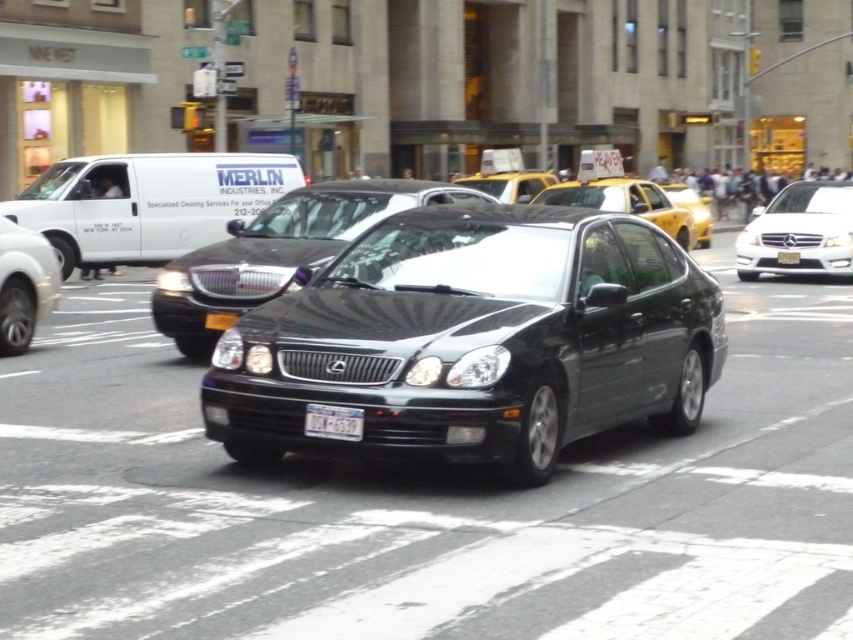
You are standing on the sidewalk and see the shiny black sedan at center approaching you. If the sedan is moving at 15 mph, how many seconds do you have before it reaches your position?

The shiny black sedan at center is 34.47 feet away. At 15 mph, it travels 22 feet per second. Dividing 34.47 by 22 gives approximately 1.566 seconds. So, you have roughly 1.57 seconds before the sedan reaches you.

You are a delivery driver who needs to park your vehicle in a space that can only accommodate vehicles narrower than 1.8 meters. You see the black metallic sedan at center and the yellow matte taxi at upper right. Which vehicle meets the parking space requirements?

The black metallic sedan at center has a width less than the yellow matte taxi at upper right. Since the parking space requires vehicles narrower than 1.8 meters, the black metallic sedan at center is the one that meets the requirement if its width is under 1.8 meters. However, the exact width isn